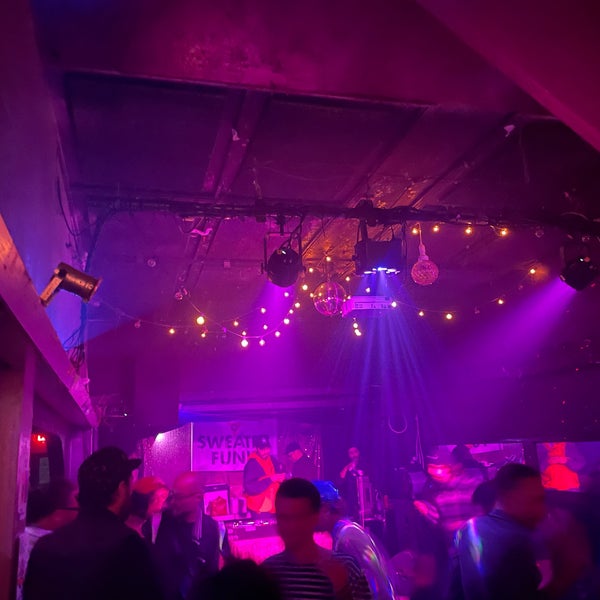
The image size is (600, 600). I want to click on bar across ceiling, so click(338, 210).